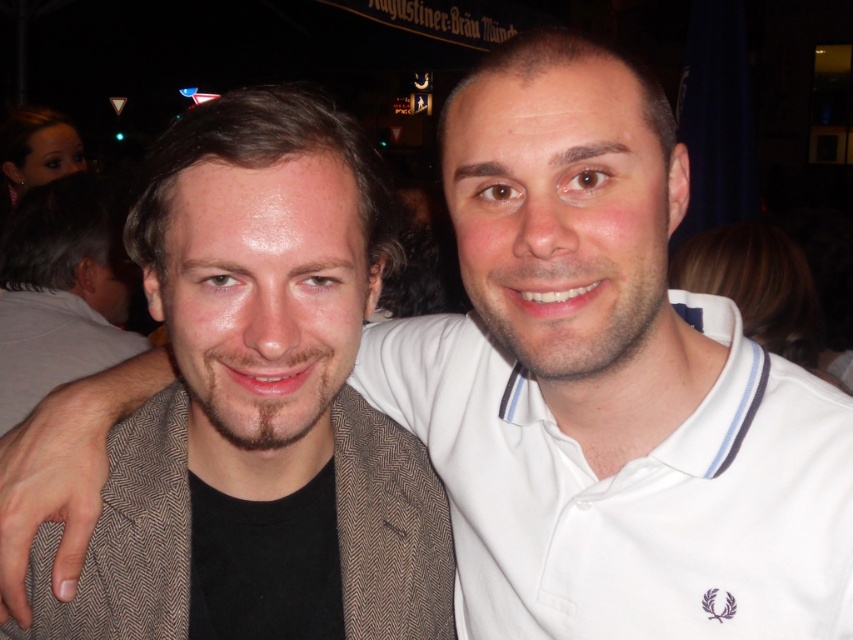
Question: Can you confirm if brown herringbone blazer at left is positioned to the left of white cotton polo shirt at center?

Choices:
 (A) yes
 (B) no

Answer: (A)

Question: Does brown herringbone blazer at left have a greater width compared to white cotton polo shirt at center?

Choices:
 (A) yes
 (B) no

Answer: (B)

Question: Among these points, which one is nearest to the camera?

Choices:
 (A) 732,552
 (B) 426,563

Answer: (A)

Question: Can you confirm if brown herringbone blazer at left is positioned above white cotton polo shirt at center?

Choices:
 (A) yes
 (B) no

Answer: (A)